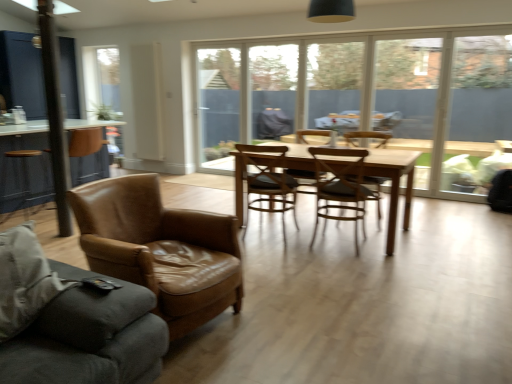
Where is `unoccupied region to the right of brown leather armchair at left, the 5th chair viewed from the back`? The width and height of the screenshot is (512, 384). unoccupied region to the right of brown leather armchair at left, the 5th chair viewed from the back is located at coordinates (294, 315).